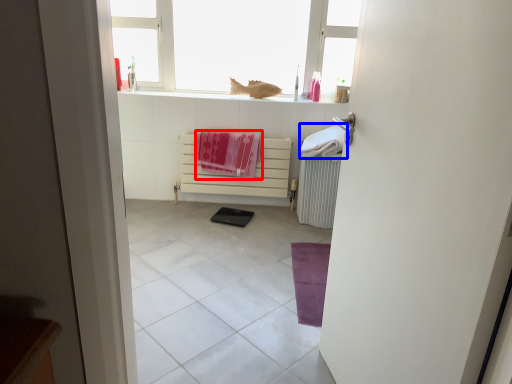
Question: Among these objects, which one is farthest to the camera, beach towel (highlighted by a red box) or beach towel (highlighted by a blue box)?

Choices:
 (A) beach towel
 (B) beach towel

Answer: (A)